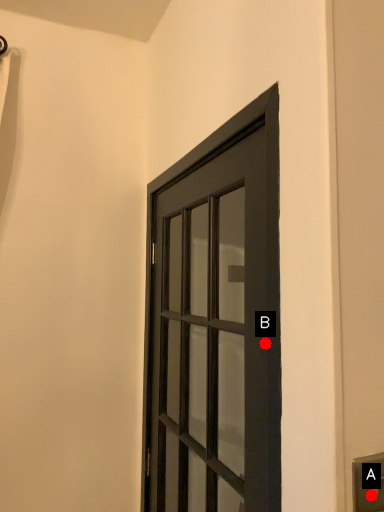
Question: Two points are circled on the image, labeled by A and B beside each circle. Which point is farther from the camera taking this photo?

Choices:
 (A) A is further
 (B) B is further

Answer: (B)